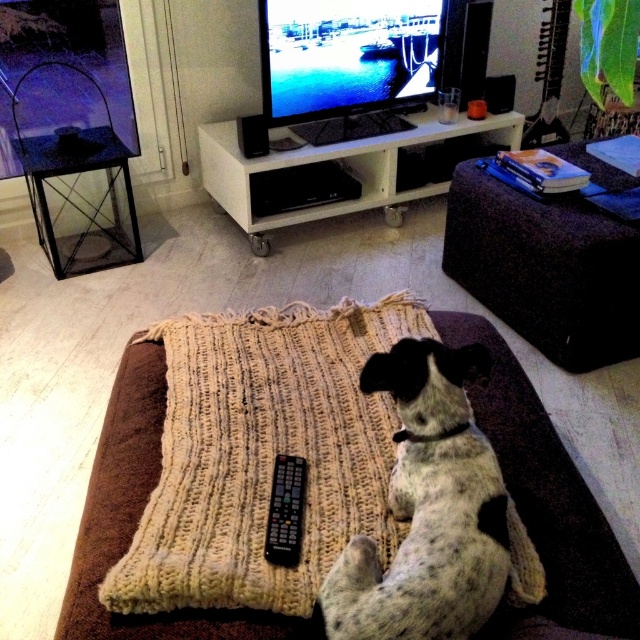
You are a guest in the living room and want to place a tall plant next to the purple fabric at upper right and the white glossy entertainment center at center. Which location would allow the plant to fit without hitting the ceiling?

The purple fabric at upper right has a greater height compared to the white glossy entertainment center at center, so placing the tall plant next to the purple fabric at upper right would allow it to fit without hitting the ceiling since there is more vertical space available there.